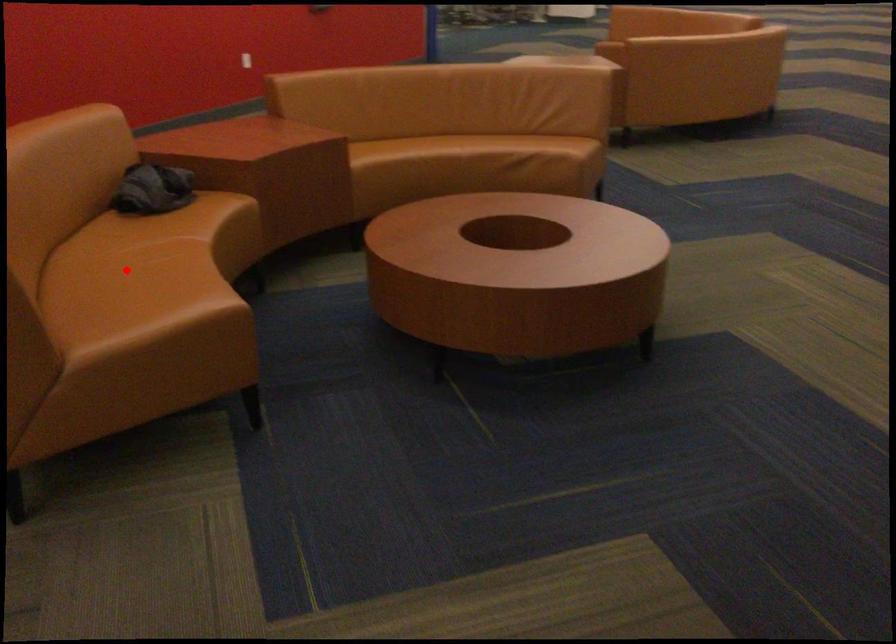
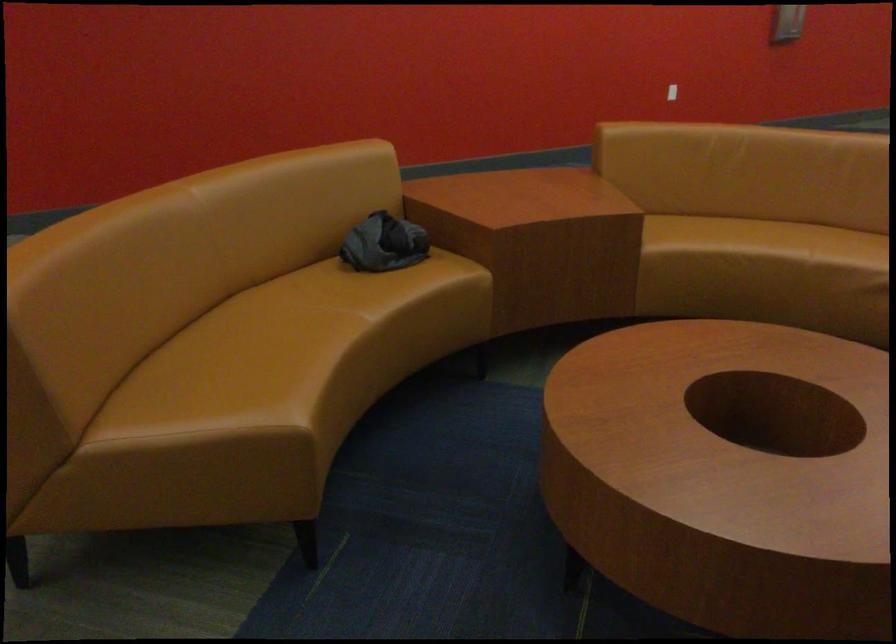
Where in the second image is the point corresponding to the highlighted location from the first image?

(271, 336)